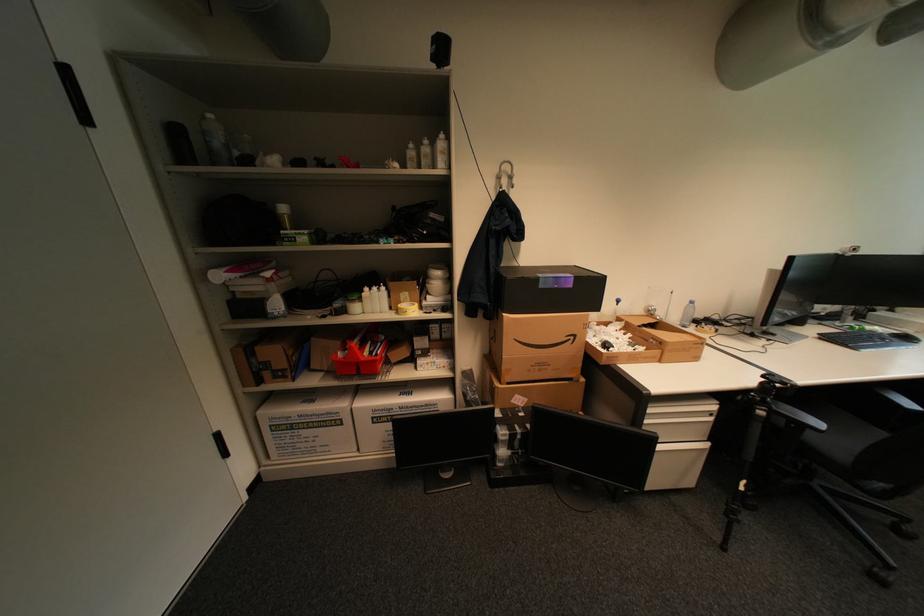
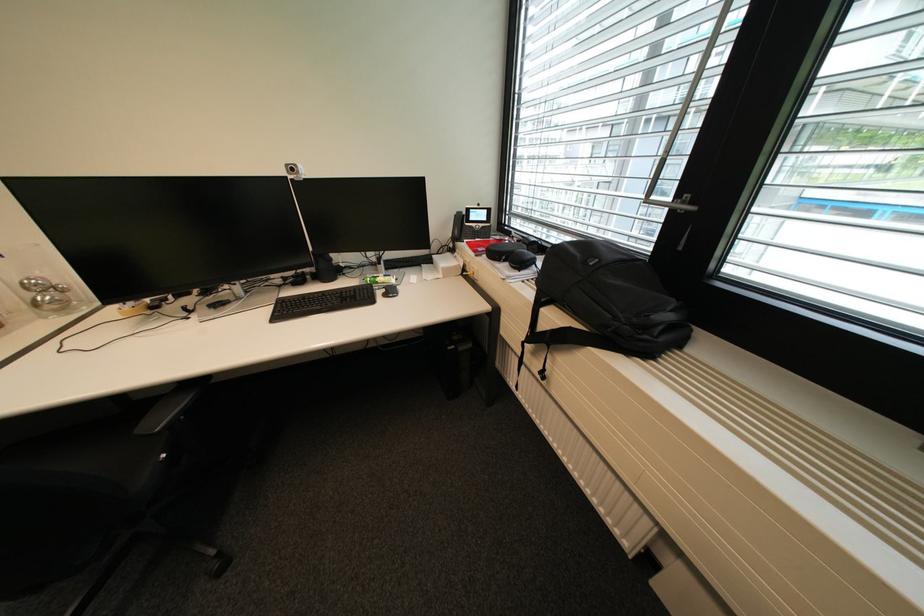
Question: What movement of the cameraman would produce the second image?

Choices:
 (A) Left
 (B) Right
 (C) Forward
 (D) Backward

Answer: (B)